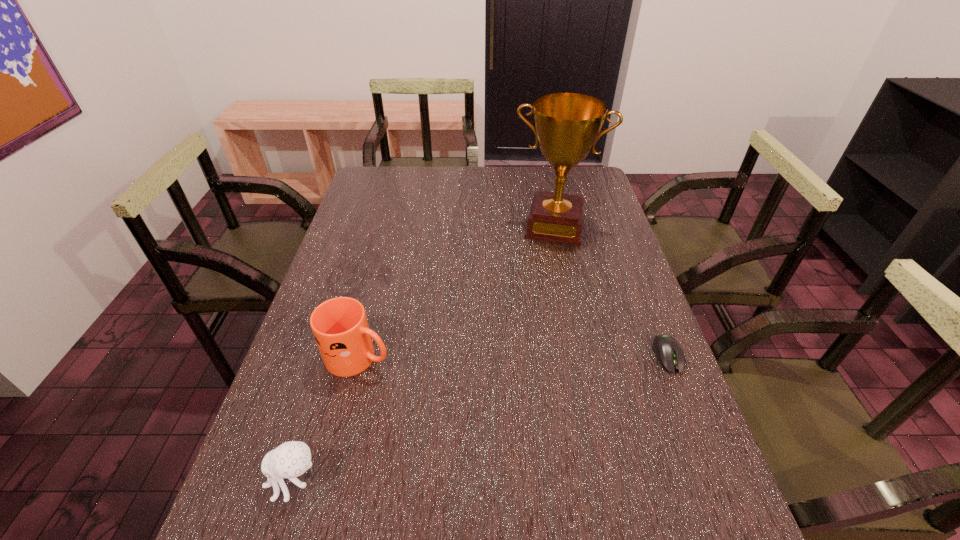
Find the location of `vacant space located 0.210m on the handle side of the second tallest object`. vacant space located 0.210m on the handle side of the second tallest object is located at coordinates (470, 389).

At what (x,y) coordinates should I click in order to perform the action: click on vacant area located on the plaque of the award. Please return your answer as a coordinate pair (x, y). Image resolution: width=960 pixels, height=540 pixels. Looking at the image, I should click on (544, 268).

What are the coordinates of `free location located 0.370m on the plaque of the award` in the screenshot? It's located at (534, 329).

What are the coordinates of `vacant point located 0.390m on the plaque of the award` in the screenshot? It's located at point(533,335).

Locate an element on the screen. object present at the near edge is located at coordinates (291, 459).

The image size is (960, 540). I want to click on octopus that is at the left edge, so click(291, 459).

The width and height of the screenshot is (960, 540). I want to click on mug present at the left edge, so click(x=340, y=327).

I want to click on computer mouse present at the right edge, so click(x=669, y=353).

Identify the location of award that is at the right edge. The height and width of the screenshot is (540, 960). (567, 125).

Find the location of a particular element. The image size is (960, 540). object at the near left corner is located at coordinates (291, 459).